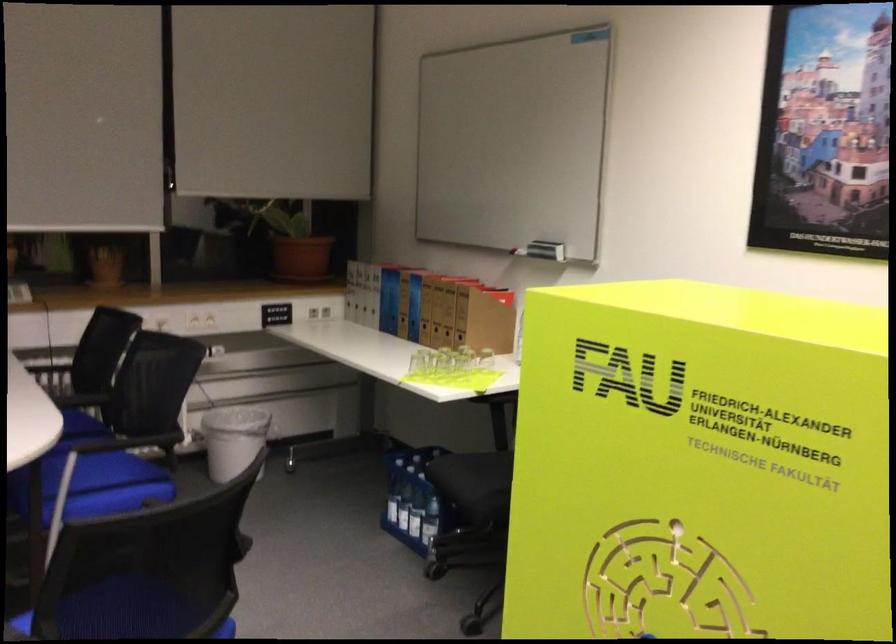
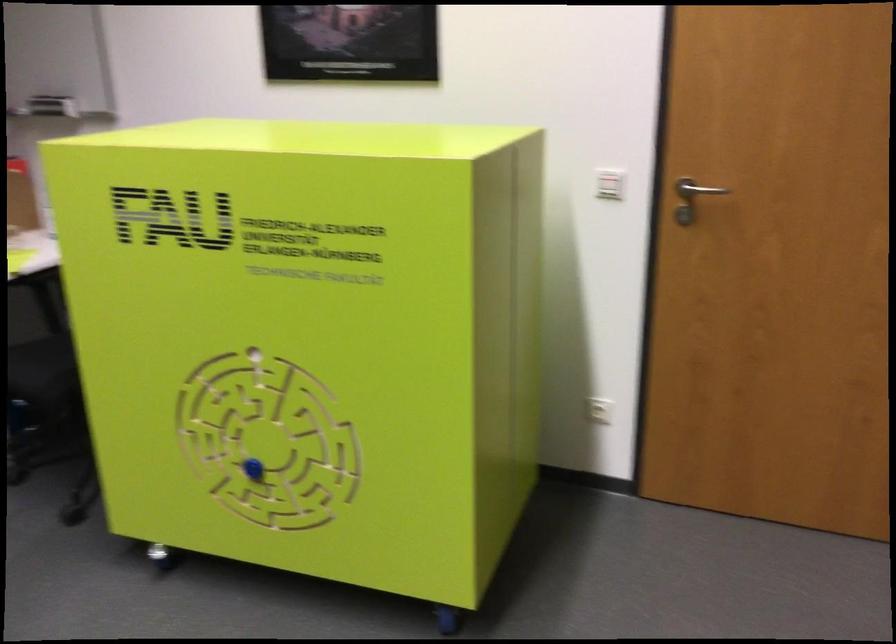
Locate, in the second image, the point that corresponds to the point at 742,531 in the first image.

(309, 341)